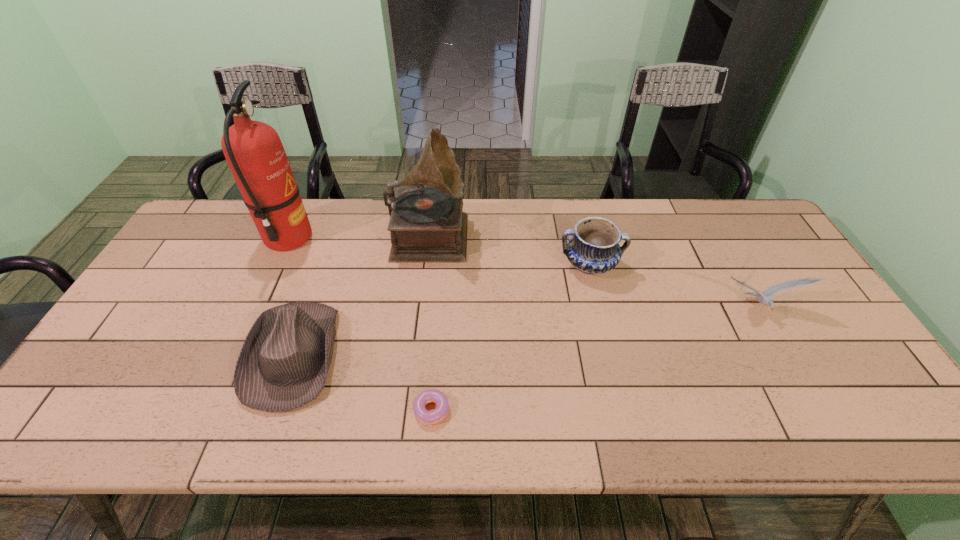
Identify the location of vacant space that's between the rightmost object and the fire extinguisher. (522, 273).

Identify the location of object that is the closest to the doughnut. (283, 364).

This screenshot has width=960, height=540. I want to click on object that stands as the third closest to the fedora, so click(422, 414).

At what (x,y) coordinates should I click in order to perform the action: click on vacant space that satisfies the following two spatial constraints: 1. from the horn of the fifth shortest object; 2. on the back side of the fifth object from left to right. Please return your answer as a coordinate pair (x, y). The height and width of the screenshot is (540, 960). Looking at the image, I should click on (426, 265).

What are the coordinates of `blank space that satisfies the following two spatial constraints: 1. from the horn of the record player; 2. on the back side of the doughnut` in the screenshot? It's located at (408, 409).